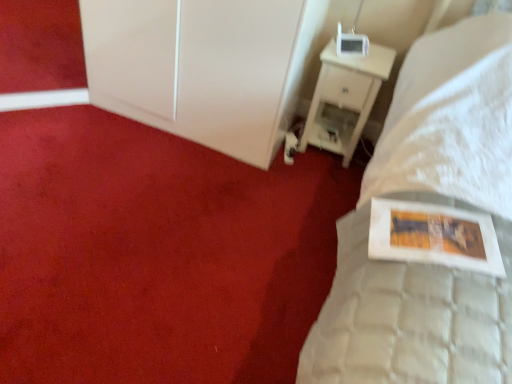
Question: Does white glossy picture frame at upper right come behind white wood nightstand at upper right?

Choices:
 (A) no
 (B) yes

Answer: (A)

Question: Can you confirm if white glossy picture frame at upper right is bigger than white wood nightstand at upper right?

Choices:
 (A) no
 (B) yes

Answer: (B)

Question: Is white glossy picture frame at upper right to the left of white wood nightstand at upper right from the viewer's perspective?

Choices:
 (A) no
 (B) yes

Answer: (B)

Question: From a real-world perspective, is white glossy picture frame at upper right beneath white wood nightstand at upper right?

Choices:
 (A) no
 (B) yes

Answer: (B)

Question: Is white glossy picture frame at upper right thinner than white wood nightstand at upper right?

Choices:
 (A) no
 (B) yes

Answer: (A)

Question: From the image's perspective, is white glossy picture frame at upper right above or below white wood nightstand at upper right?

Choices:
 (A) below
 (B) above

Answer: (A)

Question: From a real-world perspective, is white glossy picture frame at upper right physically located above or below white wood nightstand at upper right?

Choices:
 (A) above
 (B) below

Answer: (B)

Question: Does point (216, 210) appear closer or farther from the camera than point (323, 130)?

Choices:
 (A) closer
 (B) farther

Answer: (A)

Question: Considering the positions of white glossy picture frame at upper right and white wood nightstand at upper right in the image, is white glossy picture frame at upper right taller or shorter than white wood nightstand at upper right?

Choices:
 (A) short
 (B) tall

Answer: (A)

Question: From a real-world perspective, relative to white wood nightstand at upper right, is white glossy cabinet at upper left vertically above or below?

Choices:
 (A) below
 (B) above

Answer: (B)

Question: In the image, is white glossy cabinet at upper left positioned in front of or behind white wood nightstand at upper right?

Choices:
 (A) behind
 (B) front

Answer: (B)

Question: Considering the positions of white glossy cabinet at upper left and white wood nightstand at upper right in the image, is white glossy cabinet at upper left bigger or smaller than white wood nightstand at upper right?

Choices:
 (A) small
 (B) big

Answer: (B)

Question: From the image's perspective, relative to white wood nightstand at upper right, is white glossy cabinet at upper left above or below?

Choices:
 (A) above
 (B) below

Answer: (A)

Question: From the image's perspective, is white wood nightstand at upper right positioned above or below white glossy cabinet at upper left?

Choices:
 (A) above
 (B) below

Answer: (B)

Question: From their relative heights in the image, would you say white wood nightstand at upper right is taller or shorter than white glossy cabinet at upper left?

Choices:
 (A) short
 (B) tall

Answer: (A)